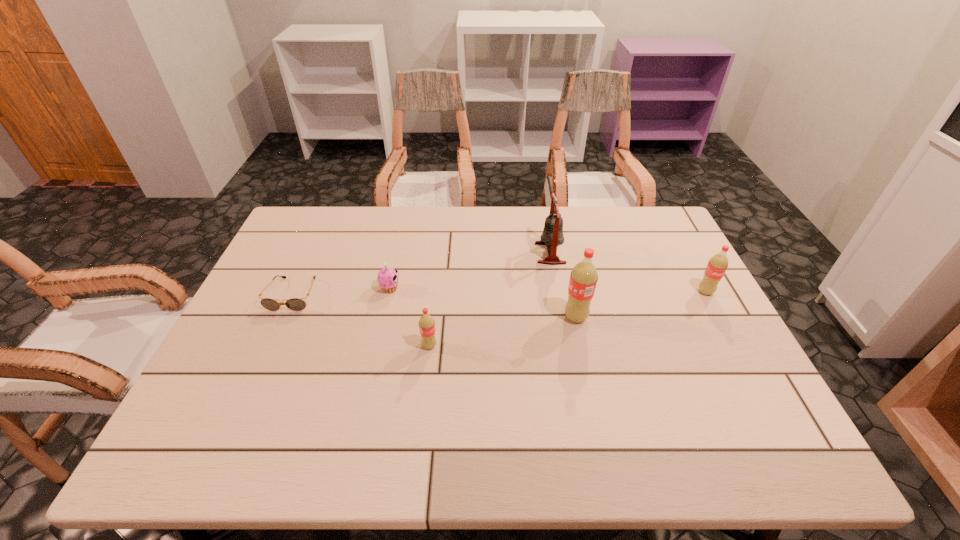
Where is `the farthest object`? the farthest object is located at coordinates (552, 236).

Find the location of `bell`. bell is located at coordinates (552, 236).

Where is `free location located on the front of the fourth tallest object`? This screenshot has width=960, height=540. free location located on the front of the fourth tallest object is located at coordinates (424, 393).

Where is `free region located on the left of the second soda from right to left`? free region located on the left of the second soda from right to left is located at coordinates (429, 317).

In order to click on free spot located 0.220m on the back of the rightmost soda in this screenshot , I will do `click(678, 240)`.

The image size is (960, 540). What are the coordinates of `free space located 0.150m on the face of the fifth tallest object` in the screenshot? It's located at (452, 288).

The height and width of the screenshot is (540, 960). I want to click on free region located 0.130m on the lenses of the leftmost object, so click(268, 350).

Where is `free space located on the left of the second tallest object`? Image resolution: width=960 pixels, height=540 pixels. free space located on the left of the second tallest object is located at coordinates (457, 253).

Where is `object present at the far edge`? The height and width of the screenshot is (540, 960). object present at the far edge is located at coordinates (552, 236).

Locate an element on the screen. The image size is (960, 540). object located at the left edge is located at coordinates pos(295,304).